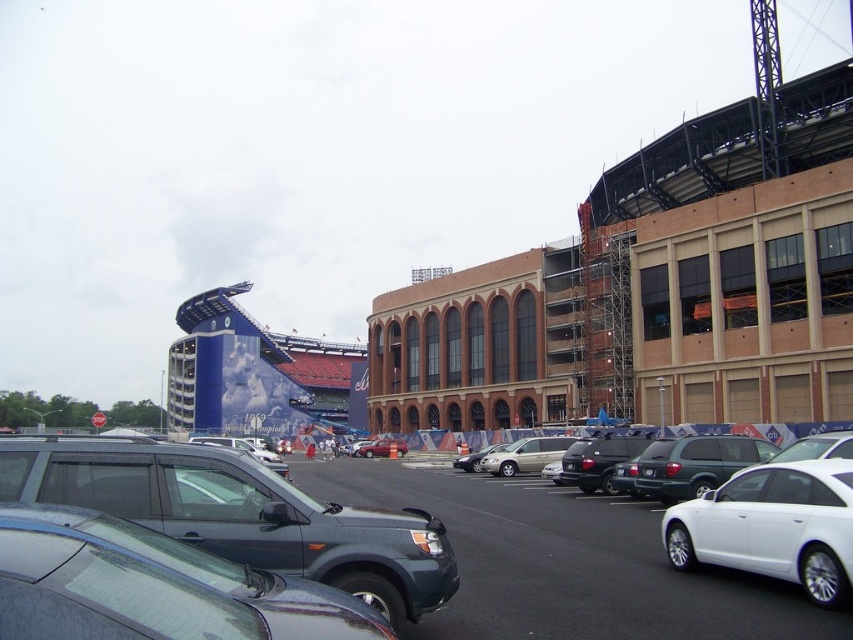
You are standing at the entrance of the stadium and want to locate the matte gray suv at center. According to the coordinates provided, where should you look relative to the entrance?

The matte gray suv at center is located at coordinates point [241,515], which would be to the right and slightly forward from the entrance.

You are standing in the parking lot looking at the stadium. There are two points marked on the pavement in front of you. The first point is at coordinates point (91, 442) and the second is at point (461, 454). Which point is closer to you?

Point (91, 442) is closer to the viewer than point (461, 454).

You are standing at the entrance of the stadium and want to locate the matte black suv at center. According to the coordinates provided, where exactly is it positioned in the parking lot?

The matte black suv at center is located at point (381, 448), which means it is positioned 70.000 units along the horizontal axis and 44.800 units along the vertical axis from the bottom left corner of the parking lot.